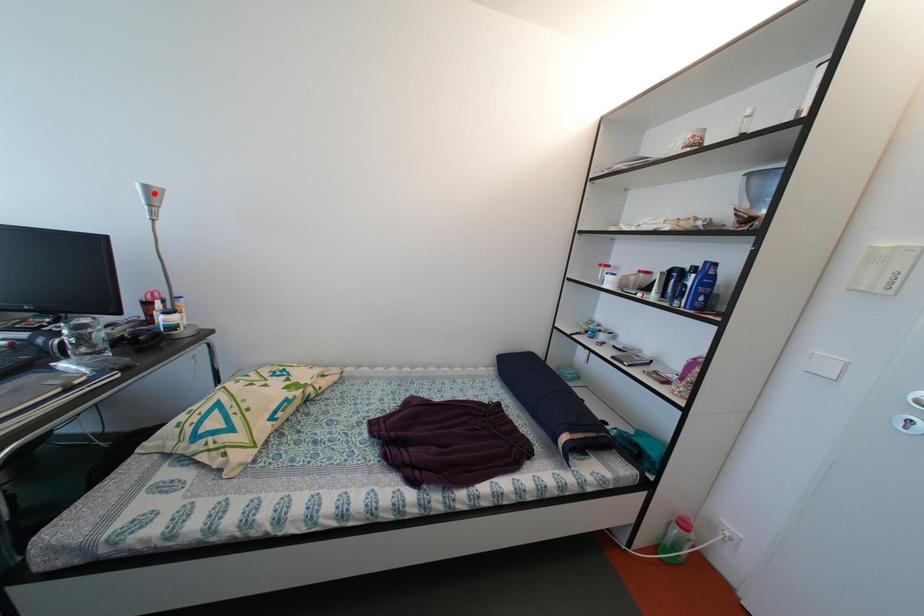
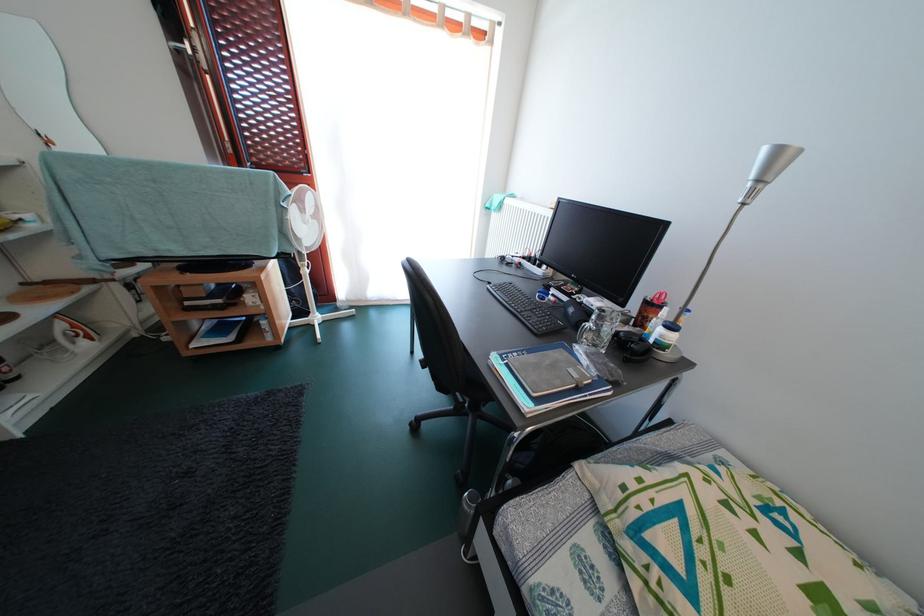
The point at the highlighted location is marked in the first image. Where is the corresponding point in the second image?

(785, 156)